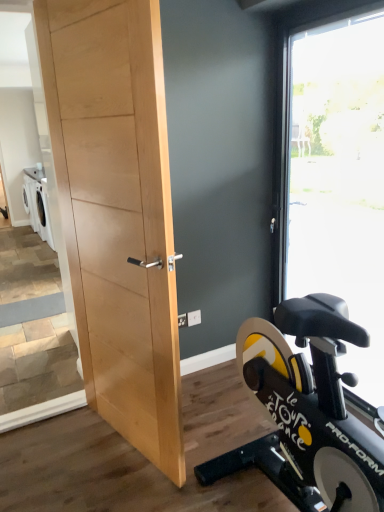
Question: Is natural wood door at center shorter than transparent glass window at right?

Choices:
 (A) no
 (B) yes

Answer: (B)

Question: Can you confirm if natural wood door at center is positioned to the left of transparent glass window at right?

Choices:
 (A) no
 (B) yes

Answer: (B)

Question: From the image's perspective, is natural wood door at center on transparent glass window at right?

Choices:
 (A) no
 (B) yes

Answer: (A)

Question: Does natural wood door at center come behind transparent glass window at right?

Choices:
 (A) yes
 (B) no

Answer: (B)

Question: Is natural wood door at center looking in the opposite direction of transparent glass window at right?

Choices:
 (A) yes
 (B) no

Answer: (A)

Question: Is natural wood door at center in front of transparent glass window at right?

Choices:
 (A) no
 (B) yes

Answer: (B)

Question: Could you tell me if transparent glass window at right is turned towards natural wood door at center?

Choices:
 (A) no
 (B) yes

Answer: (B)

Question: Would you consider transparent glass window at right to be distant from natural wood door at center?

Choices:
 (A) yes
 (B) no

Answer: (A)

Question: Can you confirm if transparent glass window at right is wider than natural wood door at center?

Choices:
 (A) yes
 (B) no

Answer: (A)

Question: Is transparent glass window at right positioned with its back to natural wood door at center?

Choices:
 (A) yes
 (B) no

Answer: (A)

Question: Is transparent glass window at right taller than natural wood door at center?

Choices:
 (A) yes
 (B) no

Answer: (A)

Question: Is transparent glass window at right outside of natural wood door at center?

Choices:
 (A) no
 (B) yes

Answer: (B)

Question: In the image, is natural wood door at center positioned in front of or behind transparent glass window at right?

Choices:
 (A) behind
 (B) front

Answer: (B)